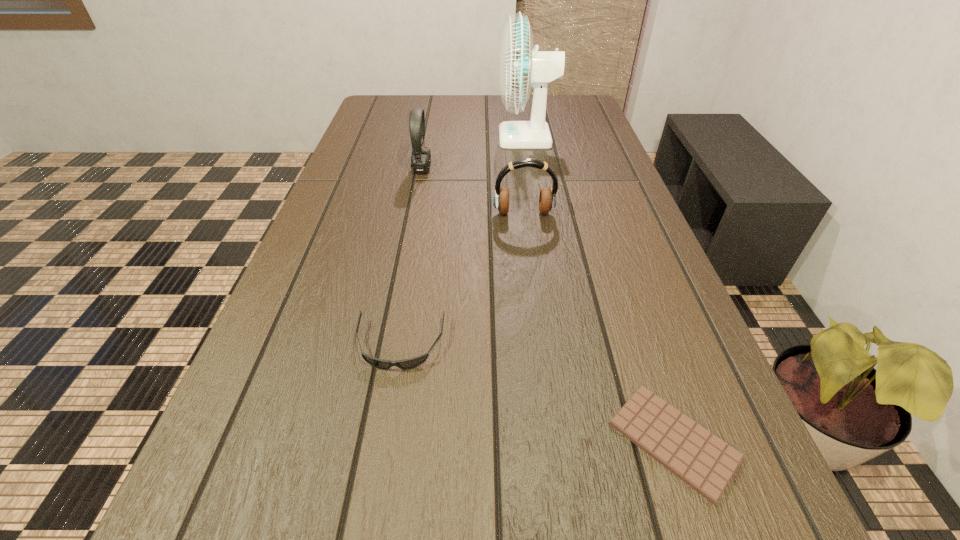
The width and height of the screenshot is (960, 540). Find the location of `free space that is in between the shortest object and the fourth farthest object`. free space that is in between the shortest object and the fourth farthest object is located at coordinates (537, 393).

Identify which object is located as the second nearest to the left headset. Please provide its 2D coordinates. Your answer should be formatted as a tuple, i.e. [(x, y)], where the tuple contains the x and y coordinates of a point satisfying the conditions above.

[(547, 200)]

Select which object is the closest to the tallest object. Please provide its 2D coordinates. Your answer should be formatted as a tuple, i.e. [(x, y)], where the tuple contains the x and y coordinates of a point satisfying the conditions above.

[(421, 158)]

Image resolution: width=960 pixels, height=540 pixels. I want to click on free location that satisfies the following two spatial constraints: 1. in front of the fan to face the airflow; 2. on the back side of the chocolate bar, so click(x=578, y=441).

Where is `free space that satisfies the following two spatial constraints: 1. in front of the nearest object to face the airflow; 2. on the right side of the fan`? This screenshot has height=540, width=960. free space that satisfies the following two spatial constraints: 1. in front of the nearest object to face the airflow; 2. on the right side of the fan is located at coordinates (578, 441).

In order to click on vacant space that satisfies the following two spatial constraints: 1. in front of the fan to face the airflow; 2. on the ear cup of the third nearest object in this screenshot , I will do `click(540, 213)`.

This screenshot has width=960, height=540. Identify the location of free location that satisfies the following two spatial constraints: 1. in front of the chocolate bar to face the airflow; 2. on the left side of the fan. coord(578,441).

The height and width of the screenshot is (540, 960). I want to click on free spot that satisfies the following two spatial constraints: 1. in front of the fan to face the airflow; 2. on the front-facing side of the sunglasses, so click(x=562, y=345).

Find the location of a particular element. The width and height of the screenshot is (960, 540). vacant space that satisfies the following two spatial constraints: 1. on the front-facing side of the sunglasses; 2. on the right side of the nearest object is located at coordinates (384, 441).

Find the location of a particular element. The height and width of the screenshot is (540, 960). vacant space that satisfies the following two spatial constraints: 1. in front of the fan to face the airflow; 2. on the front-facing side of the second nearest object is located at coordinates (562, 345).